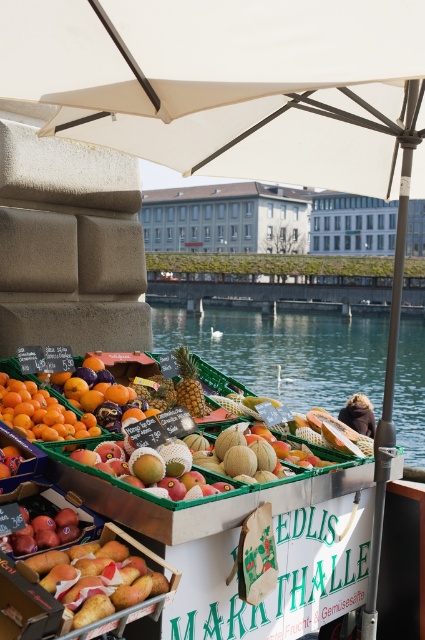
You are a customer at the EDLIS MARKTHALLE market stall. You see a yellow matte pineapple at center and a smooth brown vendor at center. Which item is bigger?

The yellow matte pineapple at center is larger in size than the smooth brown vendor at center.

You are a customer at the market stall and want to buy the fruit that takes up more space on the display. Which fruit should you choose between the smooth yellow mango at center and the yellow matte pineapple at center?

The smooth yellow mango at center is larger in size than the yellow matte pineapple at center, so it takes up more space on the display. Choose the smooth yellow mango at center.